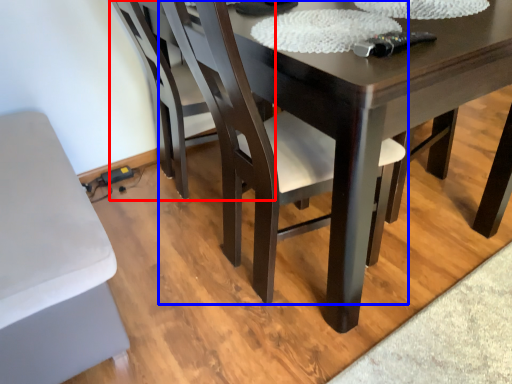
Question: Which object appears closest to the camera in this image, chair (highlighted by a red box) or chair (highlighted by a blue box)?

Choices:
 (A) chair
 (B) chair

Answer: (B)